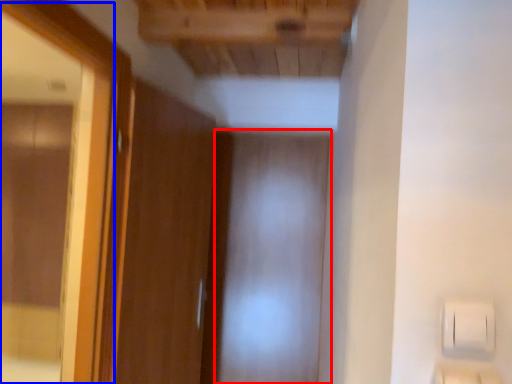
Question: Which object appears closest to the camera in this image, screen door (highlighted by a red box) or mirror (highlighted by a blue box)?

Choices:
 (A) screen door
 (B) mirror

Answer: (B)